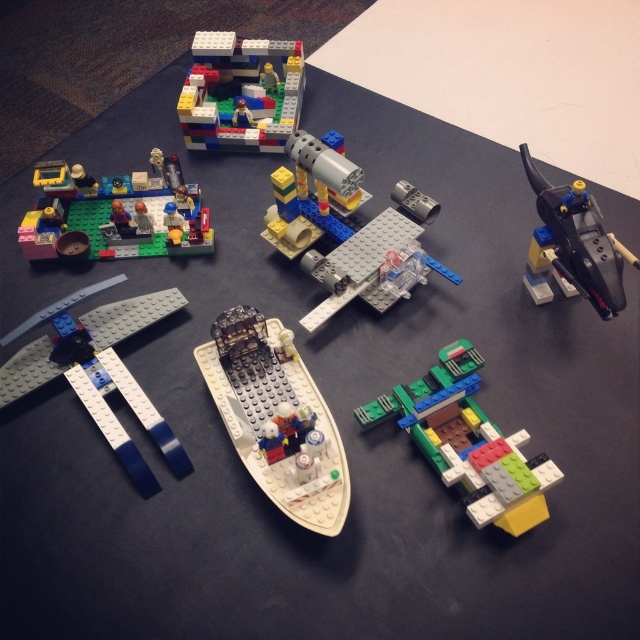
Is point (285, 490) more distant than point (125, 218)?

No, it is in front of (125, 218).

Does white plastic boat at center have a lesser width compared to brick green plastic building at upper left?

Yes, white plastic boat at center is thinner than brick green plastic building at upper left.

Between point (321, 496) and point (93, 221), which one is positioned behind?

The point (93, 221) is more distant.

The image size is (640, 640). I want to click on white plastic boat at center, so [276, 417].

Between brick green plastic building at upper left and brick red plastic building at upper center, which one has less height?

brick green plastic building at upper left

Between brick green plastic building at upper left and brick red plastic building at upper center, which one appears on the right side from the viewer's perspective?

Positioned to the right is brick red plastic building at upper center.

Does point (88, 204) lie in front of point (280, 138)?

Yes.

The image size is (640, 640). In order to click on brick green plastic building at upper left in this screenshot , I will do `click(116, 212)`.

Is multicolored plastic spaceship at lower right smaller than brick-like yellow and red rocket ship at center?

Yes, multicolored plastic spaceship at lower right is smaller than brick-like yellow and red rocket ship at center.

Is point (424, 378) closer to viewer compared to point (300, 186)?

Yes, it is.

Locate an element on the screen. This screenshot has height=640, width=640. multicolored plastic spaceship at lower right is located at coordinates (468, 442).